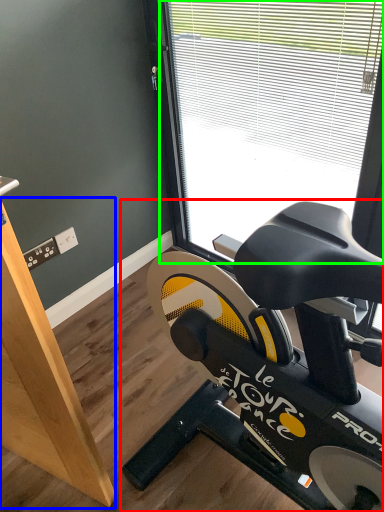
Question: Which object is positioned farthest from stationary bicycle (highlighted by a red box)? Select from plywood (highlighted by a blue box) and window (highlighted by a green box).

Choices:
 (A) plywood
 (B) window

Answer: (B)